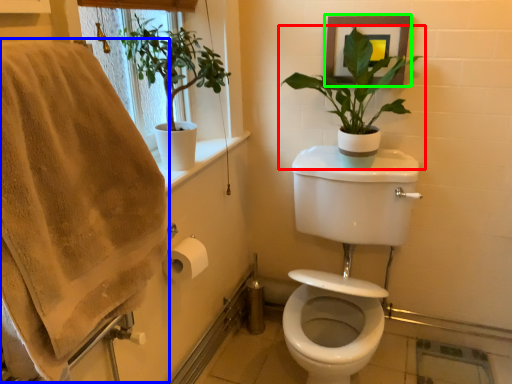
Question: Estimate the real-world distances between objects in this image. Which object is farther from houseplant (highlighted by a red box), bath towel (highlighted by a blue box) or picture frame (highlighted by a green box)?

Choices:
 (A) bath towel
 (B) picture frame

Answer: (A)